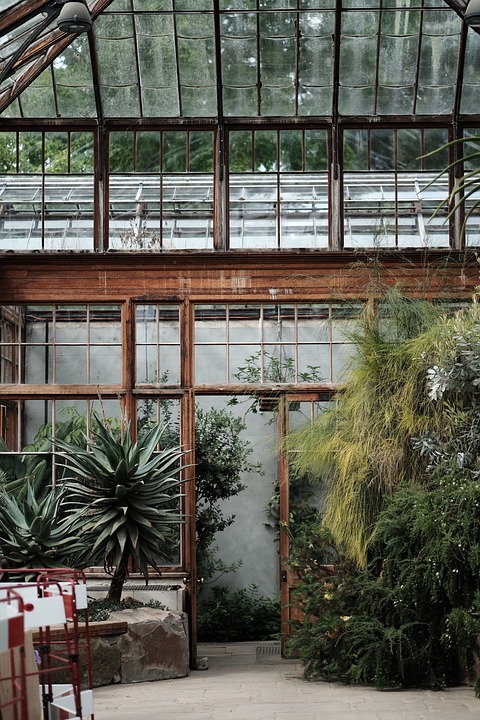
Identify the location of ceiling window trim. click(93, 63), click(462, 52).